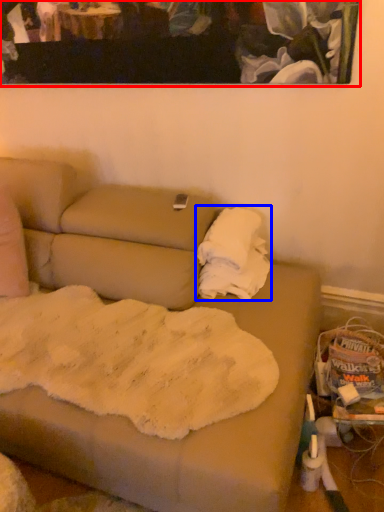
Question: Which object appears farthest to the camera in this image, picture frame (highlighted by a red box) or cloth (highlighted by a blue box)?

Choices:
 (A) picture frame
 (B) cloth

Answer: (B)